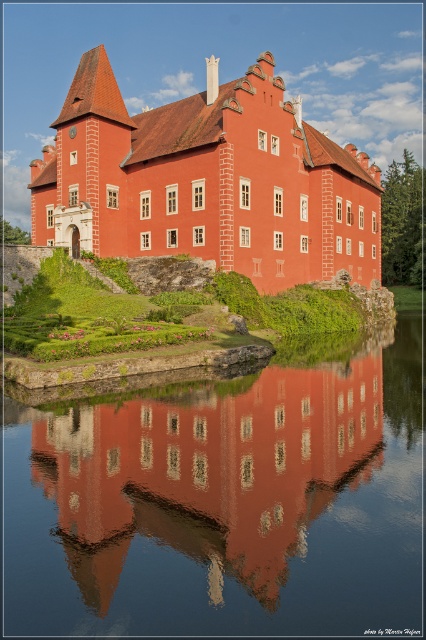
Does smooth glass water at center appear on the right side of matte red stone castle at center?

Correct, you'll find smooth glass water at center to the right of matte red stone castle at center.

Who is positioned more to the left, smooth glass water at center or matte red stone castle at center?

Positioned to the left is matte red stone castle at center.

Is point (256, 474) positioned in front of point (250, 225)?

Yes, point (256, 474) is closer to viewer.

At what (x,y) coordinates should I click in order to perform the action: click on smooth glass water at center. Please return your answer as a coordinate pair (x, y). This screenshot has height=640, width=426. Looking at the image, I should click on (224, 500).